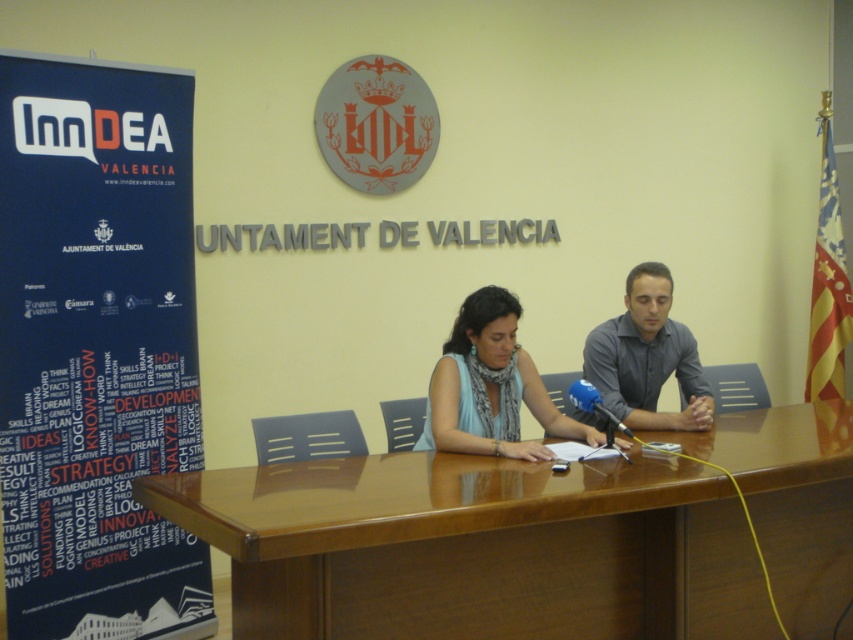
Question: Which of the following is the closest to the observer?

Choices:
 (A) (635, 614)
 (B) (67, 424)
 (C) (451, 374)

Answer: (A)

Question: Among these objects, which one is nearest to the camera?

Choices:
 (A) blue fabric scarf at center
 (B) blue metallic microphone at center
 (C) glossy wood table at center

Answer: (C)

Question: In this image, where is glossy wood table at center located relative to blue fabric banner at left?

Choices:
 (A) above
 (B) below

Answer: (B)

Question: Estimate the real-world distances between objects in this image. Which object is closer to the blue fabric banner at left?

Choices:
 (A) glossy wood table at center
 (B) blue fabric scarf at center
 (C) gray shirt at center

Answer: (B)

Question: Is gray shirt at center thinner than blue metallic microphone at center?

Choices:
 (A) no
 (B) yes

Answer: (A)

Question: Does glossy wood table at center lie behind blue fabric scarf at center?

Choices:
 (A) yes
 (B) no

Answer: (B)